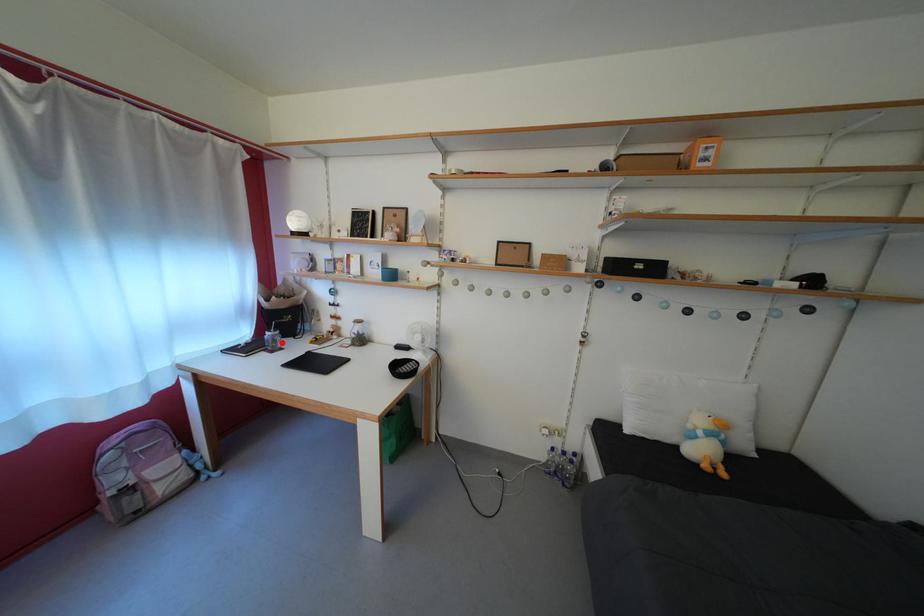
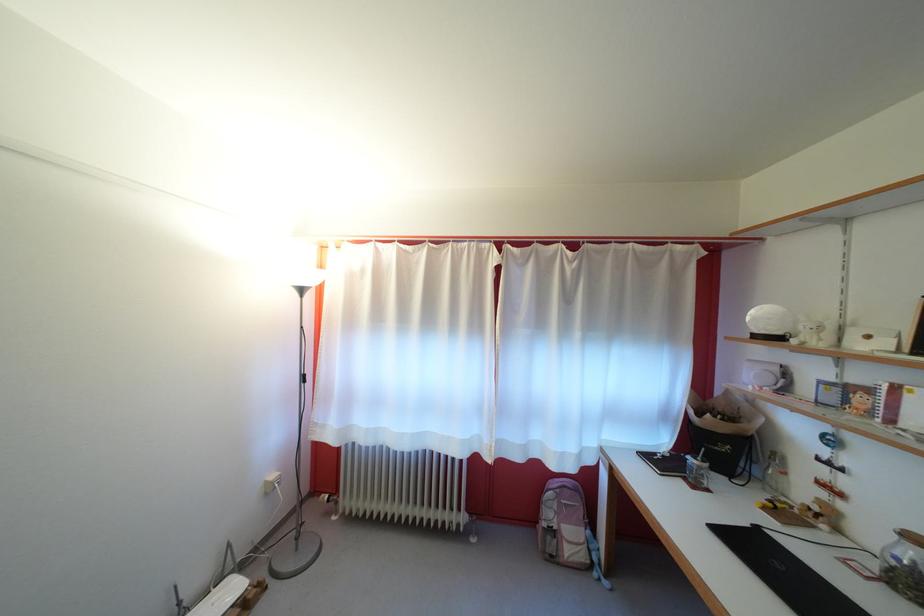
Find the pixel in the second image that matches the highlighted location in the first image.

(708, 474)